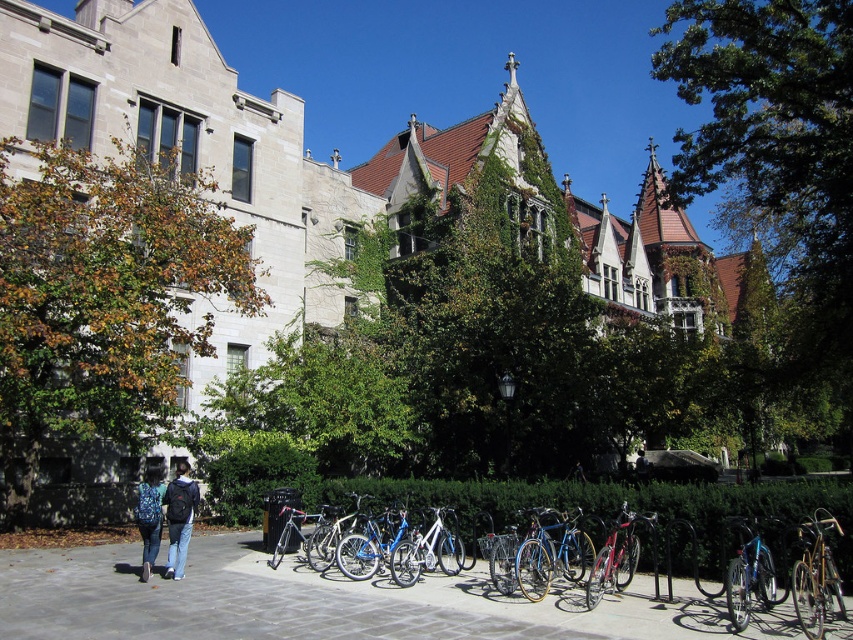
Which is behind, point (361, 477) or point (306, 545)?

The point (361, 477) is behind.

Is green leafy hedge at lower center to the left of shiny silver bicycle at center from the viewer's perspective?

No, green leafy hedge at lower center is not to the left of shiny silver bicycle at center.

Find the location of a particular element. green leafy hedge at lower center is located at coordinates (630, 506).

What are the coordinates of `green leafy hedge at lower center` in the screenshot? It's located at (630, 506).

Does gray concrete pavement at lower center appear over dark blue jeans at center?

Indeed, gray concrete pavement at lower center is positioned over dark blue jeans at center.

Can you confirm if gray concrete pavement at lower center is shorter than dark blue jeans at center?

Correct, gray concrete pavement at lower center is not as tall as dark blue jeans at center.

Is point (242, 611) farther from camera compared to point (641, 477)?

No.

At what (x,y) coordinates should I click in order to perform the action: click on gray concrete pavement at lower center. Please return your answer as a coordinate pair (x, y). The height and width of the screenshot is (640, 853). Looking at the image, I should click on (326, 602).

Can you confirm if shiny blue bicycle at lower right is positioned above denim jacket at lower left?

Actually, shiny blue bicycle at lower right is below denim jacket at lower left.

Which is behind, point (740, 588) or point (152, 509)?

Point (152, 509)

At what (x,y) coordinates should I click in order to perform the action: click on shiny blue bicycle at lower right. Please return your answer as a coordinate pair (x, y). Image resolution: width=853 pixels, height=640 pixels. Looking at the image, I should click on [x=747, y=573].